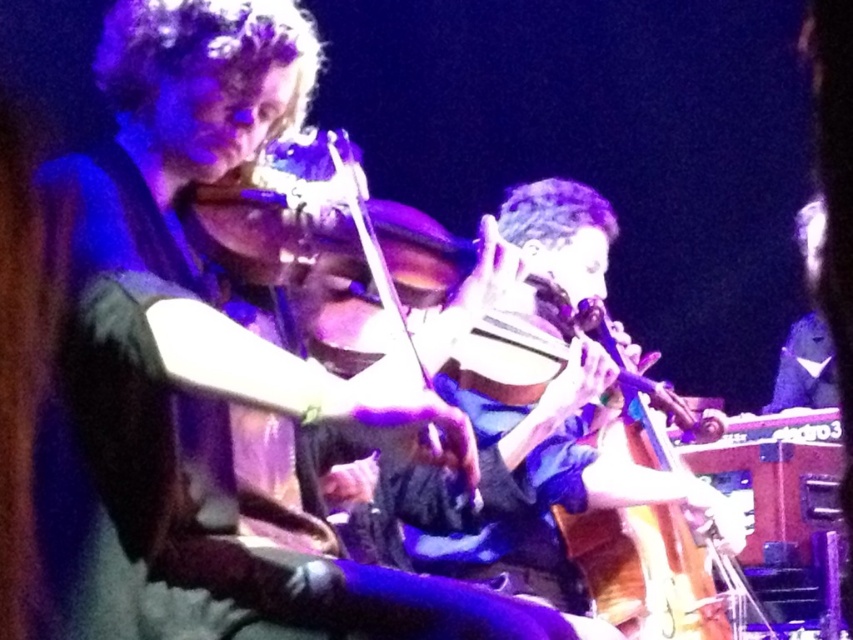
What do you see at coordinates (202, 365) in the screenshot? The image size is (853, 640). I see `matte black violin at upper center` at bounding box center [202, 365].

Does matte black violin at upper center have a lesser width compared to wooden violin at center?

Indeed, matte black violin at upper center has a lesser width compared to wooden violin at center.

I want to click on matte black violin at upper center, so click(202, 365).

Find the location of a particular element. The height and width of the screenshot is (640, 853). matte black violin at upper center is located at coordinates (202, 365).